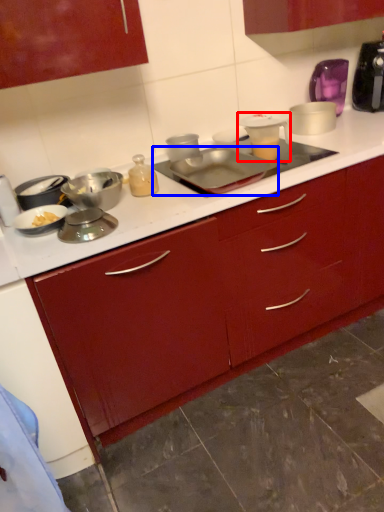
Question: Which point is closer to the camera, appliance (highlighted by a red box) or kitchen appliance (highlighted by a blue box)?

Choices:
 (A) appliance
 (B) kitchen appliance

Answer: (B)